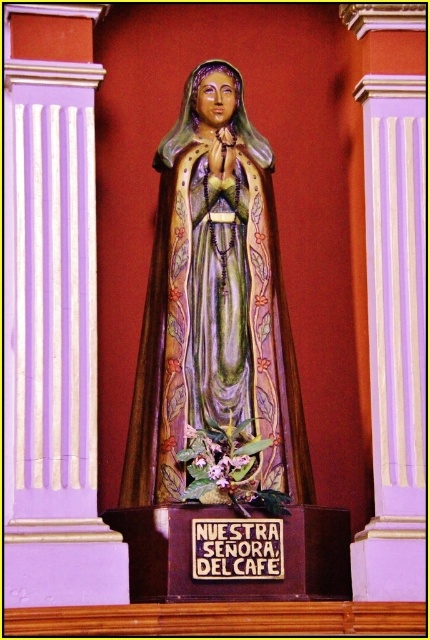
Question: Does polychrome wood statue at center have a lesser width compared to wooden plaque at center?

Choices:
 (A) no
 (B) yes

Answer: (A)

Question: Which object appears closest to the camera in this image?

Choices:
 (A) wooden plaque at center
 (B) polychrome wood statue at center

Answer: (A)

Question: Is polychrome wood statue at center to the right of wooden plaque at center from the viewer's perspective?

Choices:
 (A) no
 (B) yes

Answer: (A)

Question: Which point is closer to the camera?

Choices:
 (A) polychrome wood statue at center
 (B) wooden plaque at center

Answer: (B)

Question: Does polychrome wood statue at center have a larger size compared to wooden plaque at center?

Choices:
 (A) yes
 (B) no

Answer: (A)